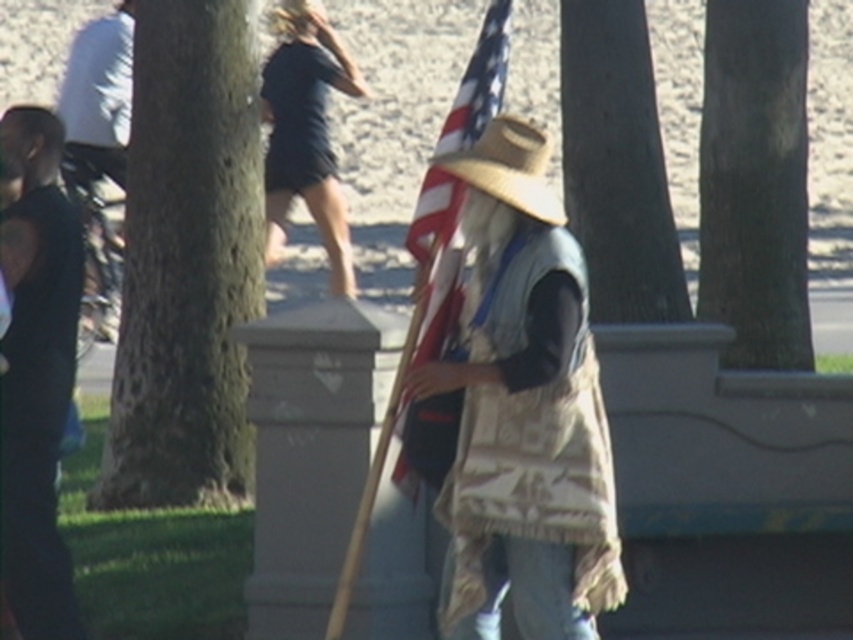
Question: Is camouflage fabric flag at center above brown rough bark tree at center?

Choices:
 (A) yes
 (B) no

Answer: (B)

Question: Is brown rough bark tree at center thinner than american flag at center?

Choices:
 (A) no
 (B) yes

Answer: (A)

Question: Which point is closer to the camera?

Choices:
 (A) (664, 256)
 (B) (21, 582)
 (C) (779, 163)
 (D) (479, 67)

Answer: (D)

Question: Is black fabric dress at upper center wider than tan woven cowboy hat at center?

Choices:
 (A) no
 (B) yes

Answer: (B)

Question: Based on their relative distances, which object is farther from the camouflage fabric flag at center?

Choices:
 (A) black sleeveless shirt at left
 (B) black fabric dress at upper center
 (C) american flag at center
 (D) brown rough tree trunk at center

Answer: (B)

Question: Estimate the real-world distances between objects in this image. Which object is closer to the camouflage fabric flag at center?

Choices:
 (A) green rough bark tree at left
 (B) black sleeveless shirt at left
 (C) brown rough tree trunk at center
 (D) black fabric dress at upper center

Answer: (B)